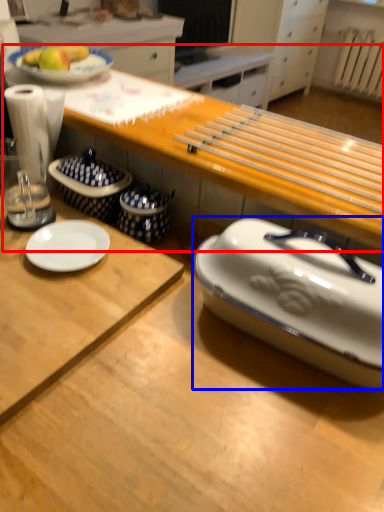
Question: Which object appears closest to the camera in this image, table (highlighted by a red box) or tableware (highlighted by a blue box)?

Choices:
 (A) table
 (B) tableware

Answer: (B)